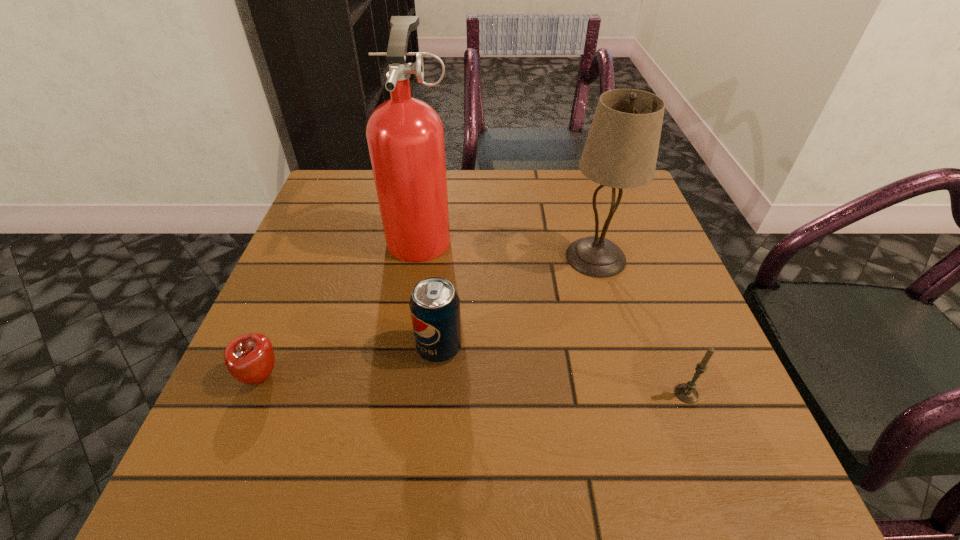
The width and height of the screenshot is (960, 540). In order to click on the second closest object to the candle in this screenshot , I will do `click(434, 304)`.

I want to click on the second closest object to the apple, so click(x=405, y=136).

This screenshot has height=540, width=960. In order to click on vacant space that satisfies the following two spatial constraints: 1. on the front side of the shortest object; 2. on the right side of the candle in this screenshot , I will do `click(254, 394)`.

You are a GUI agent. You are given a task and a screenshot of the screen. Output one action in this format:
    pyautogui.click(x=<x>, y=<y>)
    Task: Click on the free spot that satisfies the following two spatial constraints: 1. on the back side of the fourth tallest object; 2. on the front-facing side of the lampshade
    The image size is (960, 540).
    Given the screenshot: What is the action you would take?
    pyautogui.click(x=635, y=257)

You are a GUI agent. You are given a task and a screenshot of the screen. Output one action in this format:
    pyautogui.click(x=<x>, y=<y>)
    Task: Click on the vacant space that satisfies the following two spatial constraints: 1. on the front-facing side of the lampshade; 2. on the front side of the shortest object
    Image resolution: width=960 pixels, height=540 pixels.
    Given the screenshot: What is the action you would take?
    pyautogui.click(x=630, y=376)

The image size is (960, 540). In order to click on blank space that satisfies the following two spatial constraints: 1. on the front side of the candle; 2. on the right side of the shortest object in this screenshot , I will do `click(254, 394)`.

The height and width of the screenshot is (540, 960). In order to click on blank space that satisfies the following two spatial constraints: 1. on the front-facing side of the lampshade; 2. on the front side of the third tallest object in this screenshot , I will do `click(621, 348)`.

Identify the location of vacant area in the image that satisfies the following two spatial constraints: 1. on the front side of the apple; 2. on the right side of the second shortest object. (254, 394).

Locate an element on the screen. This screenshot has height=540, width=960. free location that satisfies the following two spatial constraints: 1. on the front-facing side of the second tallest object; 2. on the left side of the second shortest object is located at coordinates (635, 394).